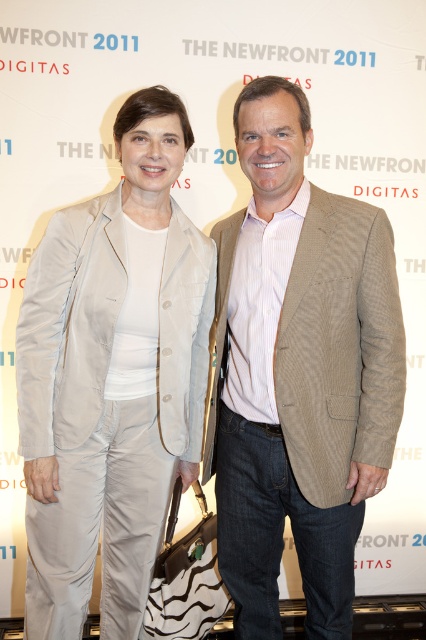
You are a photographer setting up for a photoshoot with two models wearing the light beige satin suit at center and the beige corduroy blazer at center. The backdrop has the words

The light beige satin suit at center is positioned on the left side of the beige corduroy blazer at center, so the photographer should place the model in the light beige satin suit at center to the left of the model in the beige corduroy blazer at center to match their positions as shown in the image.

You are a fashion designer analyzing the image of two people wearing different beige blazers. The light beige satin suit at center and the beige corduroy blazer at center are both in the center. Which one has a wider silhouette?

The light beige satin suit at center has a wider silhouette than the beige corduroy blazer at center because its width surpasses the latter.

You are a fashion designer observing two outfits in the image. The outfits are the light beige satin suit at center and the beige corduroy blazer at center. Which outfit is placed lower in the image?

The light beige satin suit at center is positioned under the beige corduroy blazer at center, so it is placed lower in the image.